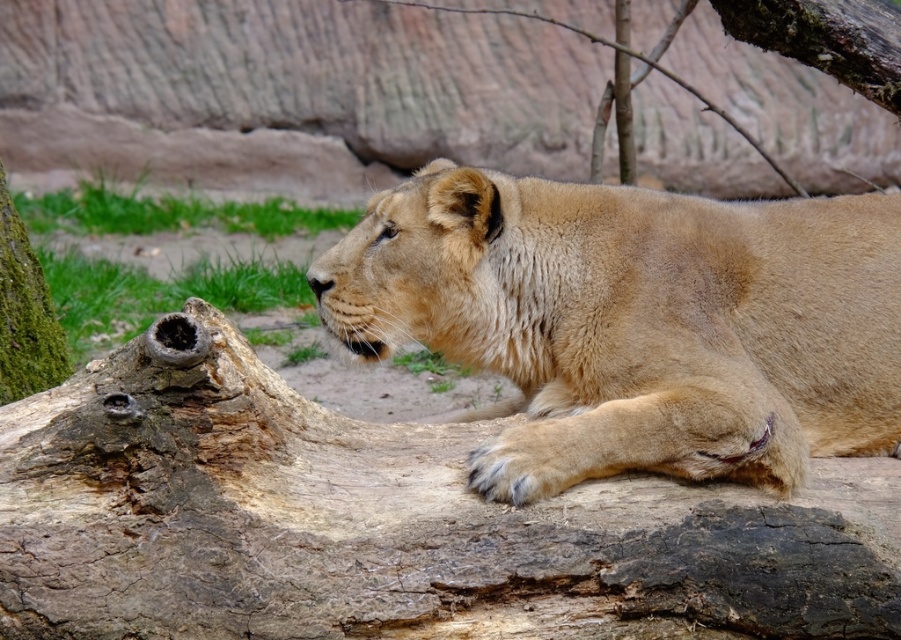
Question: Considering the relative positions of brown rough tree trunk at center and fuzzy golden lion at center in the image provided, where is brown rough tree trunk at center located with respect to fuzzy golden lion at center?

Choices:
 (A) right
 (B) left

Answer: (B)

Question: Can you confirm if brown rough tree trunk at center is positioned above fuzzy golden lion at center?

Choices:
 (A) yes
 (B) no

Answer: (B)

Question: Among these objects, which one is farthest from the camera?

Choices:
 (A) brown rough tree trunk at center
 (B) fuzzy golden lion at center

Answer: (B)

Question: Considering the relative positions of brown rough tree trunk at center and fuzzy golden lion at center in the image provided, where is brown rough tree trunk at center located with respect to fuzzy golden lion at center?

Choices:
 (A) above
 (B) below

Answer: (B)

Question: Which point is closer to the camera?

Choices:
 (A) brown rough tree trunk at center
 (B) fuzzy golden lion at center

Answer: (A)